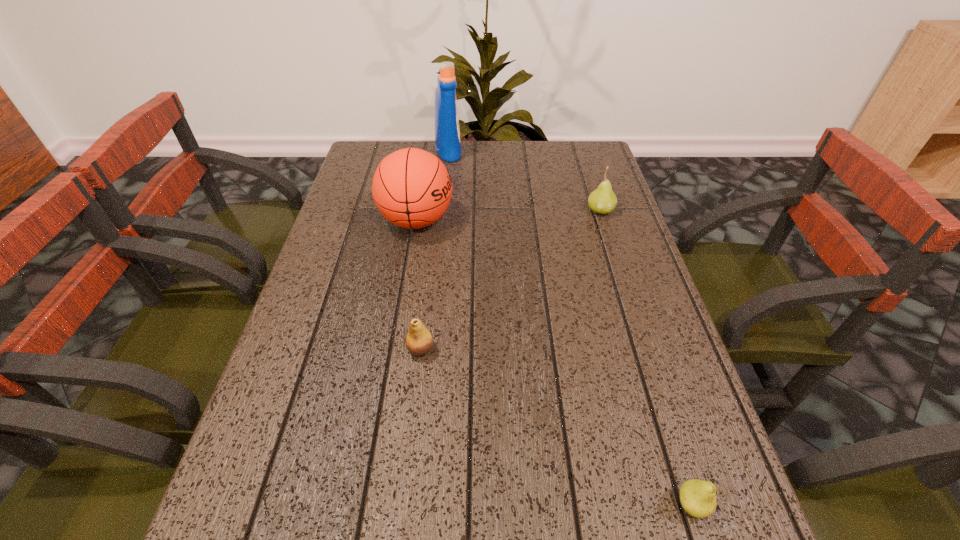
At what (x,y) coordinates should I click in order to perform the action: click on pear that stands as the closest to the tallest object. Please return your answer as a coordinate pair (x, y). Image resolution: width=960 pixels, height=540 pixels. Looking at the image, I should click on (603, 200).

Find the location of a particular element. This screenshot has width=960, height=540. vacant region that satisfies the following two spatial constraints: 1. on the back side of the nearest pear; 2. on the side with logo of the second tallest object is located at coordinates (602, 220).

Image resolution: width=960 pixels, height=540 pixels. I want to click on vacant space that satisfies the following two spatial constraints: 1. on the back side of the leftmost pear; 2. on the right side of the farthest pear, so click(437, 210).

The width and height of the screenshot is (960, 540). What are the coordinates of `vacant space that satisfies the following two spatial constraints: 1. on the back side of the nearest pear; 2. on the left side of the farthest pear` in the screenshot? It's located at (598, 210).

The height and width of the screenshot is (540, 960). I want to click on vacant space that satisfies the following two spatial constraints: 1. on the label of the detergent; 2. on the left side of the nearest object, so click(413, 505).